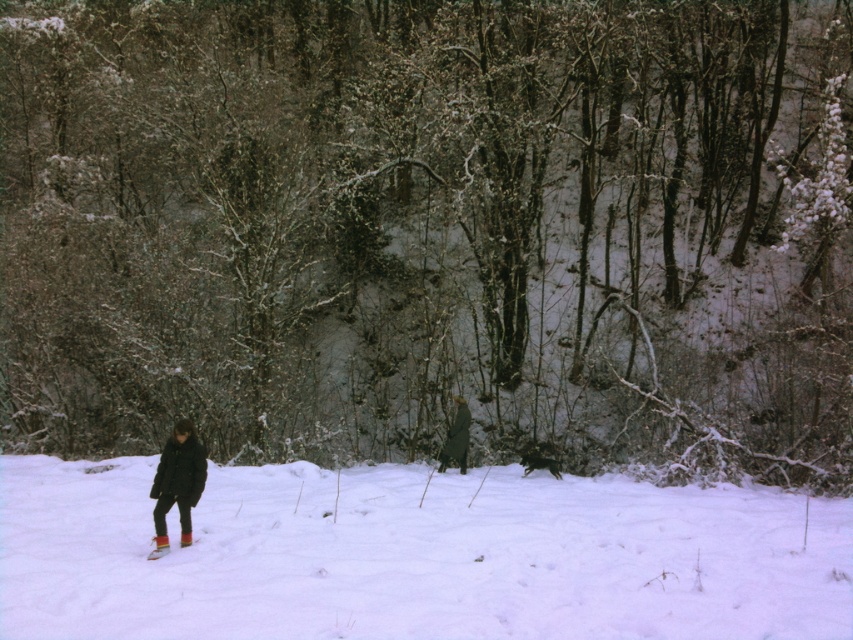
How far apart are white fluffy snow at center and green wool coat at center?

white fluffy snow at center is 5.98 meters from green wool coat at center.

Which is more to the right, white fluffy snow at center or green wool coat at center?

From the viewer's perspective, green wool coat at center appears more on the right side.

Who is more forward, [531,632] or [462,467]?

Point [531,632] is more forward.

Where is `white fluffy snow at center`? white fluffy snow at center is located at coordinates (415, 556).

How distant is white fluffy snow at center from multicolored fabric ski at lower left?

They are 15.58 feet apart.

Image resolution: width=853 pixels, height=640 pixels. Describe the element at coordinates (415, 556) in the screenshot. I see `white fluffy snow at center` at that location.

Describe the element at coordinates (415, 556) in the screenshot. I see `white fluffy snow at center` at that location.

The height and width of the screenshot is (640, 853). I want to click on white fluffy snow at center, so click(x=415, y=556).

Is green wool coat at center below multicolored fabric ski at lower left?

No, green wool coat at center is not below multicolored fabric ski at lower left.

From the picture: Does green wool coat at center have a greater height compared to multicolored fabric ski at lower left?

Yes, green wool coat at center is taller than multicolored fabric ski at lower left.

Between point (453, 454) and point (186, 540), which one is positioned in front?

Point (186, 540) is more forward.

The height and width of the screenshot is (640, 853). What are the coordinates of `green wool coat at center` in the screenshot? It's located at (456, 436).